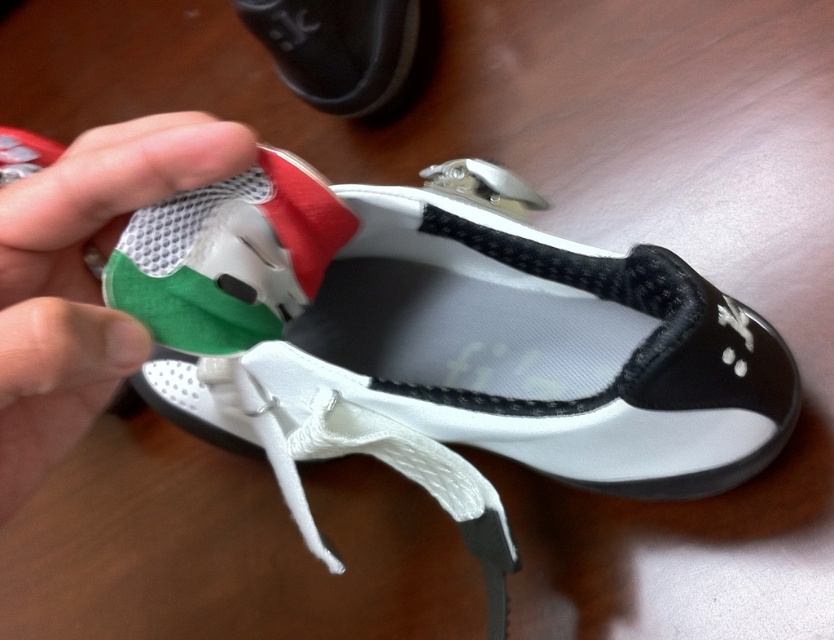
Question: Is white mesh shoe at center below green mesh fabric at lower left?

Choices:
 (A) yes
 (B) no

Answer: (B)

Question: Estimate the real-world distances between objects in this image. Which object is farther from the matte black shoe at upper center?

Choices:
 (A) green mesh fabric at lower left
 (B) white mesh shoe at center

Answer: (A)

Question: Which point is closer to the camera?

Choices:
 (A) matte black shoe at upper center
 (B) green mesh fabric at lower left
 (C) white mesh shoe at center

Answer: (B)

Question: Among these objects, which one is farthest from the camera?

Choices:
 (A) green mesh fabric at lower left
 (B) matte black shoe at upper center
 (C) white mesh shoe at center

Answer: (B)

Question: Is white mesh shoe at center wider than green mesh fabric at lower left?

Choices:
 (A) yes
 (B) no

Answer: (A)

Question: Where is green mesh fabric at lower left located in relation to matte black shoe at upper center in the image?

Choices:
 (A) above
 (B) below

Answer: (B)